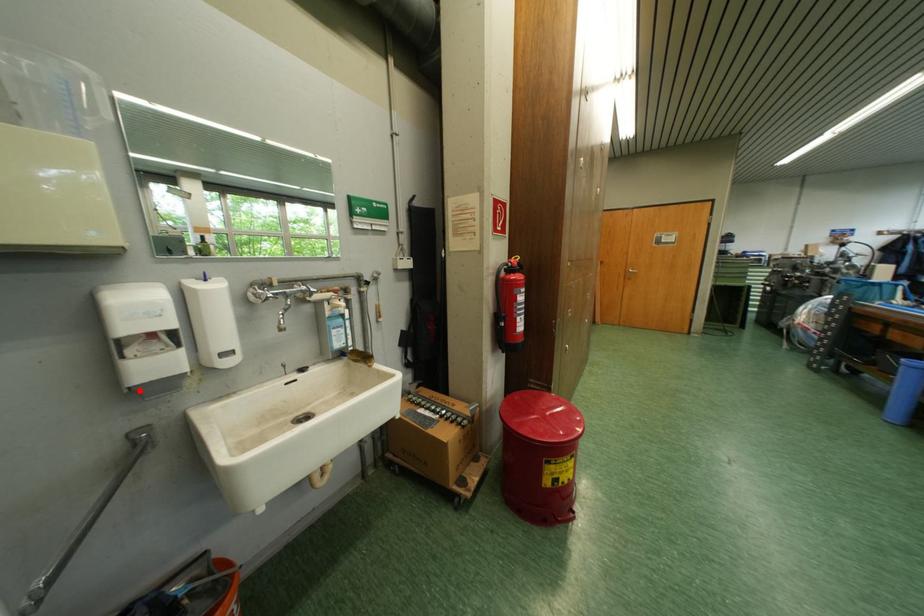
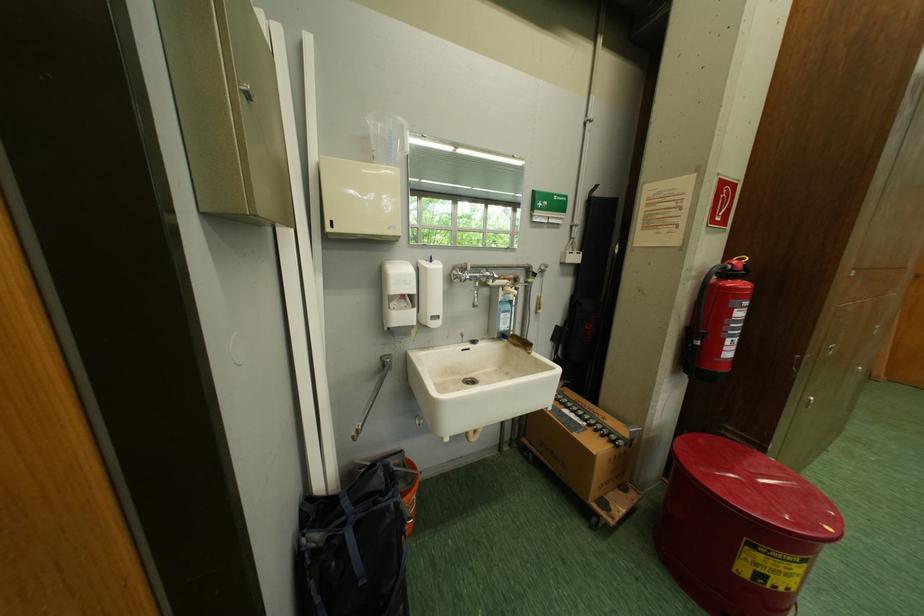
Locate, in the second image, the point that corresponds to the highlighted location in the first image.

(399, 331)